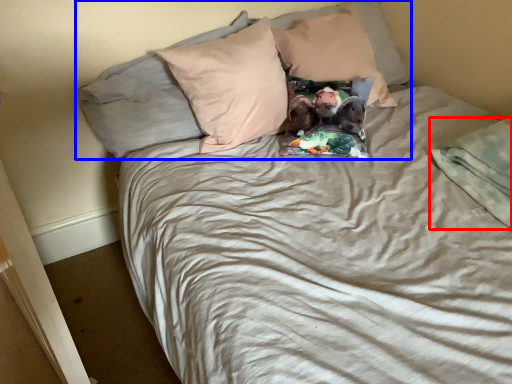
Question: Which object appears closest to the camera in this image, blanket (highlighted by a red box) or pillow (highlighted by a blue box)?

Choices:
 (A) blanket
 (B) pillow

Answer: (A)